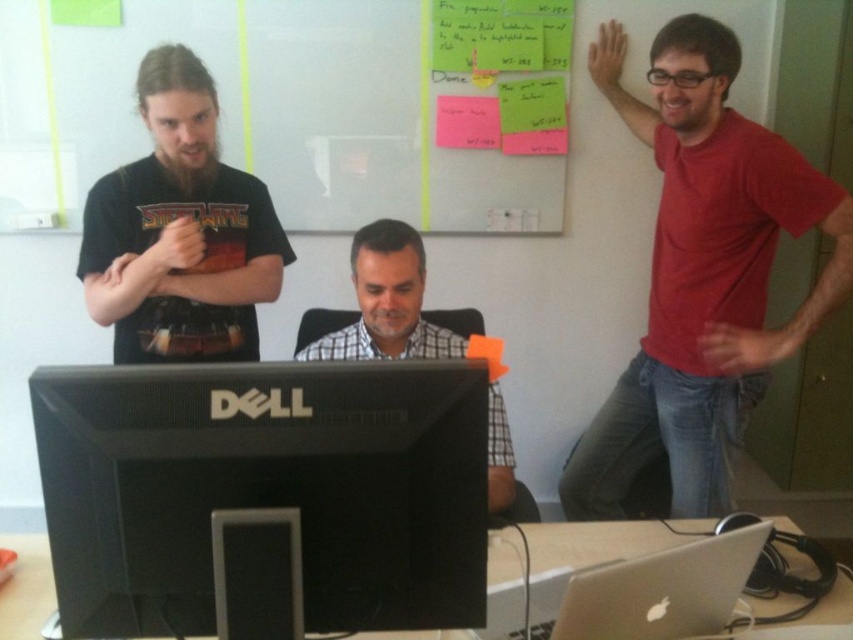
You are a delivery person who needs to place a package on the desk. The package is 6 feet long. Can you fit the package horizontally between the black glossy monitor at center and the pink paper at upper center?

The distance between the black glossy monitor at center and the pink paper at upper center is 5.90 feet, which is slightly less than the package length of 6 feet. Therefore, the package cannot be placed horizontally between them.

You are an office assistant who needs to hang a new poster that requires 1 meter of vertical space. Given the black glossy monitor at center and the pink paper at upper center, which object is suitable for hanging the poster above it without blocking the monitor?

The pink paper at upper center is much shorter than the black glossy monitor at center, so hanging the poster above the pink paper at upper center would require less vertical space. However, since the required vertical space is 1 meter, you need to check the actual height of the objects. If the black glossy monitor at center is much taller, it might provide sufficient space above it. Wait, the description says the monitor is much taller than the pink paper. Therefore, hanging the poster above the black glos